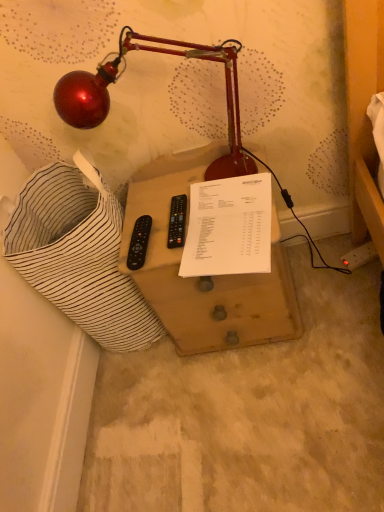
Identify the location of vacant area located to the right-hand side of wooden drawer at center. (331, 282).